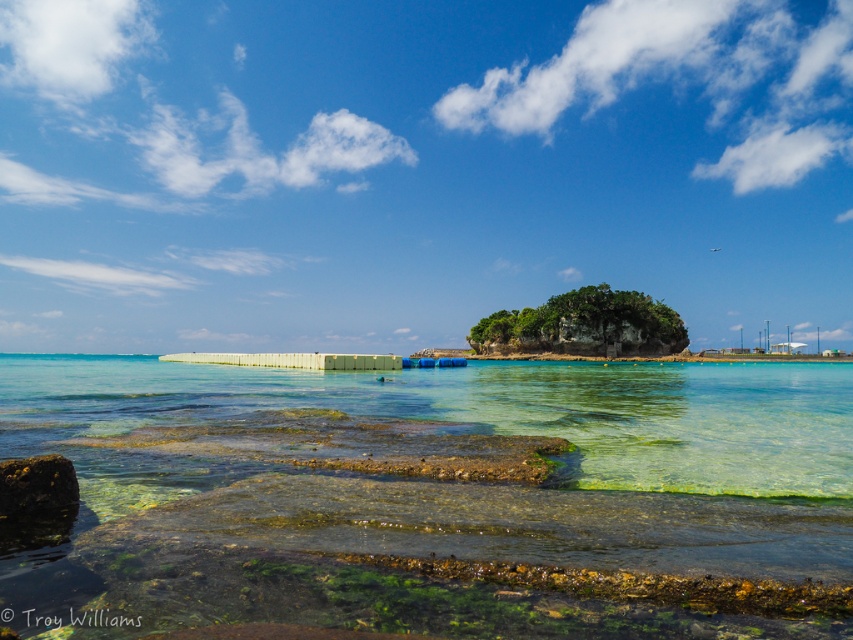
Can you confirm if clear glass water at center is wider than green mossy rock at center?

Correct, the width of clear glass water at center exceeds that of green mossy rock at center.

At what (x,y) coordinates should I click in order to perform the action: click on clear glass water at center. Please return your answer as a coordinate pair (x, y). Looking at the image, I should click on click(424, 492).

Can you confirm if green mossy rock at center is wider than rusty metallic rock at lower left?

Indeed, green mossy rock at center has a greater width compared to rusty metallic rock at lower left.

Looking at this image, does green mossy rock at center appear on the left side of rusty metallic rock at lower left?

No, green mossy rock at center is not to the left of rusty metallic rock at lower left.

Between point (538, 340) and point (1, 474), which one is positioned in front?

Point (1, 474)

This screenshot has height=640, width=853. I want to click on green mossy rock at center, so click(584, 324).

Which is more to the left, clear glass water at center or rusty metallic rock at lower left?

Positioned to the left is rusty metallic rock at lower left.

Does point (757, 536) come behind point (53, 483)?

No, it is not.

Which is behind, point (41, 588) or point (73, 492)?

Positioned behind is point (73, 492).

The width and height of the screenshot is (853, 640). I want to click on clear glass water at center, so click(424, 492).